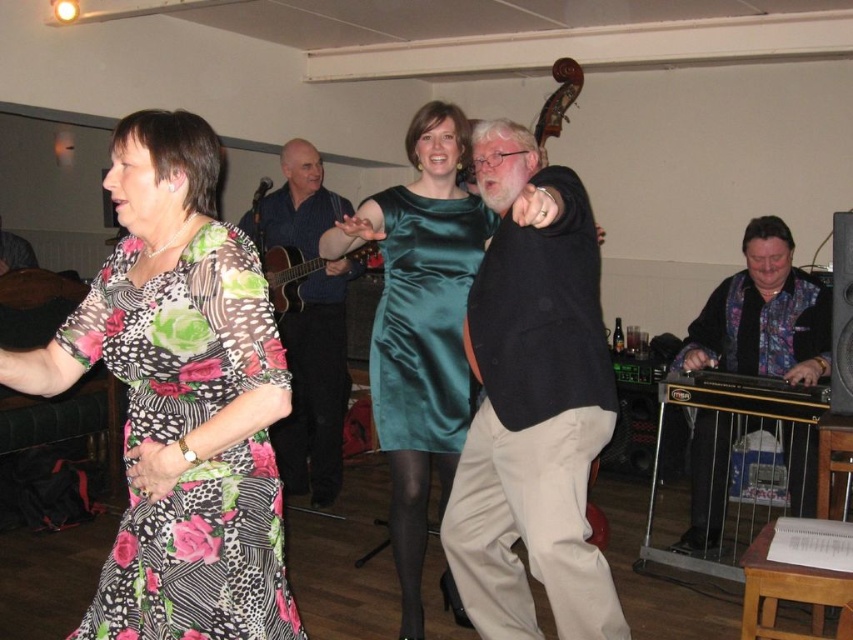
Does floral fabric shirt at right appear on the left side of teal satin dress at center?

Incorrect, floral fabric shirt at right is not on the left side of teal satin dress at center.

Between floral fabric shirt at right and teal satin dress at center, which one is positioned higher?

teal satin dress at center is above.

Is point (692, 545) closer to viewer compared to point (462, 212)?

No.

This screenshot has height=640, width=853. Identify the location of floral fabric shirt at right. 763,316.

In the scene shown: Which is below, metallic gold harmonica at center or matte brown guitar at center?

metallic gold harmonica at center

Is metallic gold harmonica at center to the right of matte brown guitar at center from the viewer's perspective?

Yes, metallic gold harmonica at center is to the right of matte brown guitar at center.

Which is in front, point (752, 387) or point (271, 256)?

Positioned in front is point (752, 387).

This screenshot has width=853, height=640. I want to click on metallic gold harmonica at center, so click(744, 394).

Does floral fabric shirt at right lie behind matte brown guitar at center?

No, it is in front of matte brown guitar at center.

Is floral fabric shirt at right smaller than matte brown guitar at center?

No.

Is point (724, 292) more distant than point (325, 262)?

No.

The width and height of the screenshot is (853, 640). I want to click on floral fabric shirt at right, so click(763, 316).